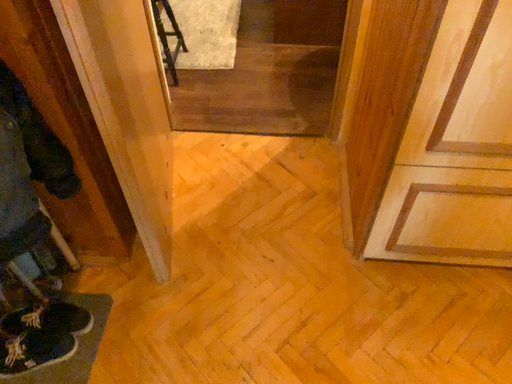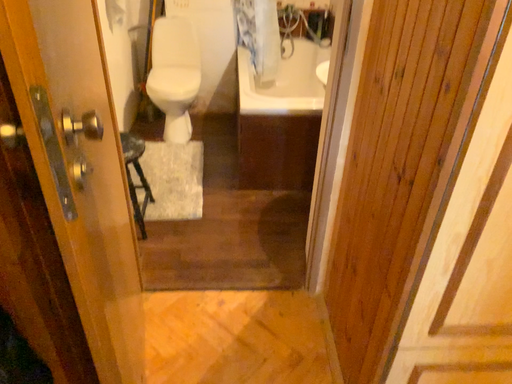
Question: Which way did the camera rotate in the video?

Choices:
 (A) rotated right
 (B) rotated left

Answer: (A)